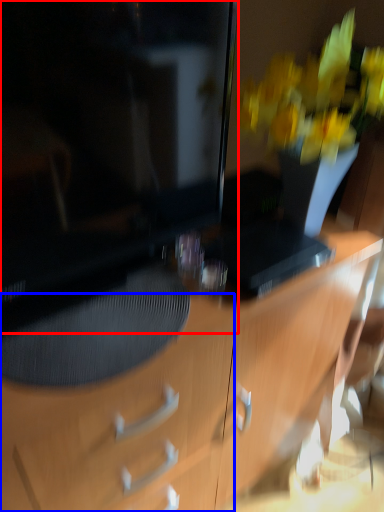
Question: Among these objects, which one is farthest to the camera, television (highlighted by a red box) or drawer (highlighted by a blue box)?

Choices:
 (A) television
 (B) drawer

Answer: (B)